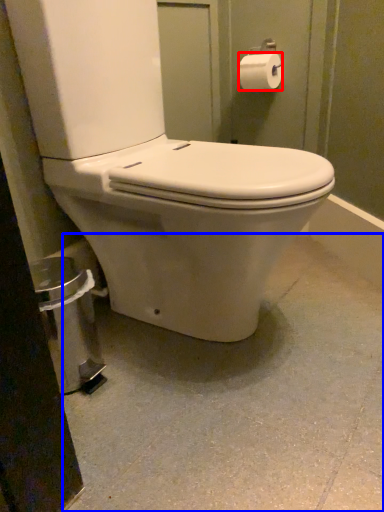
Question: Among these objects, which one is nearest to the camera, toilet paper (highlighted by a red box) or concrete (highlighted by a blue box)?

Choices:
 (A) toilet paper
 (B) concrete

Answer: (B)